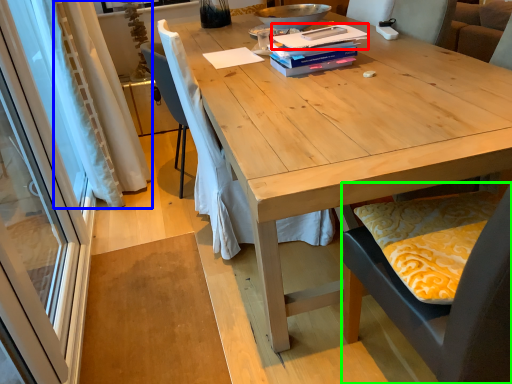
Question: Estimate the real-world distances between objects in this image. Which object is farther from paperback book (highlighted by a red box), curtain (highlighted by a blue box) or chair (highlighted by a green box)?

Choices:
 (A) curtain
 (B) chair

Answer: (A)